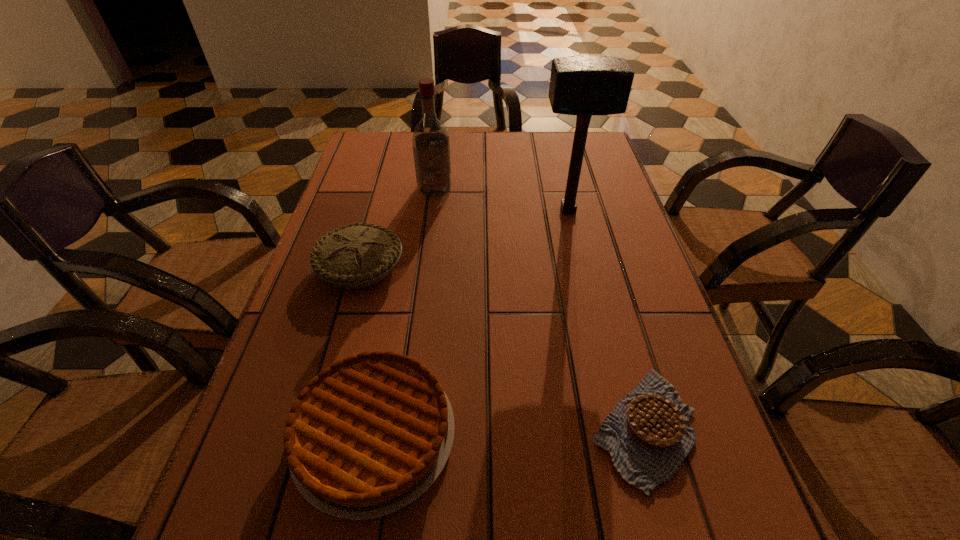
This screenshot has height=540, width=960. Identify the location of free spot between the second tallest object and the rightmost pie. (540, 308).

Find the location of a particular element. The height and width of the screenshot is (540, 960). vacant space that is in between the farthest object and the fourth nearest object is located at coordinates (501, 199).

Find the location of a particular element. The height and width of the screenshot is (540, 960). free space between the shortest pie and the farthest pie is located at coordinates (502, 347).

Find the location of a particular element. Image resolution: width=960 pixels, height=540 pixels. empty space between the third nearest object and the liquor is located at coordinates (397, 227).

Locate an element on the screen. The height and width of the screenshot is (540, 960). vacant space in between the mallet and the liquor is located at coordinates (501, 199).

Locate an element on the screen. Image resolution: width=960 pixels, height=540 pixels. unoccupied area between the farthest object and the shortest pie is located at coordinates (540, 308).

Identify which object is the fourth closest to the third farthest object. Please provide its 2D coordinates. Your answer should be formatted as a tuple, i.e. [(x, y)], where the tuple contains the x and y coordinates of a point satisfying the conditions above.

[(648, 434)]

Locate an element on the screen. object that stands as the fourth closest to the second tallest object is located at coordinates coord(648,434).

Find the location of a particular element. This screenshot has width=960, height=540. the second closest pie to the shortest pie is located at coordinates (359, 255).

Locate which pie ranks in proximity to the rightmost pie. Please provide its 2D coordinates. Your answer should be formatted as a tuple, i.e. [(x, y)], where the tuple contains the x and y coordinates of a point satisfying the conditions above.

[(368, 435)]